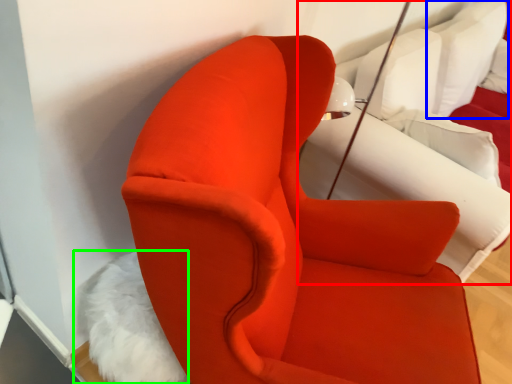
Question: Which object is the closest to the bed (highlighted by a red box)? Choose among these: pillow (highlighted by a blue box) or animal (highlighted by a green box).

Choices:
 (A) pillow
 (B) animal

Answer: (A)